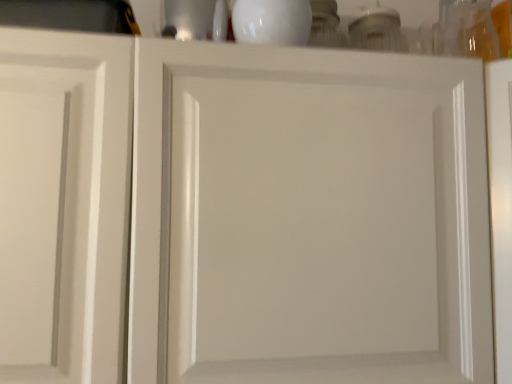
This screenshot has height=384, width=512. I want to click on translucent plastic bottle at upper right, so click(466, 30).

This screenshot has height=384, width=512. What do you see at coordinates (466, 30) in the screenshot? I see `translucent plastic bottle at upper right` at bounding box center [466, 30].

Where is `translucent plastic bottle at upper right`? The width and height of the screenshot is (512, 384). translucent plastic bottle at upper right is located at coordinates [466, 30].